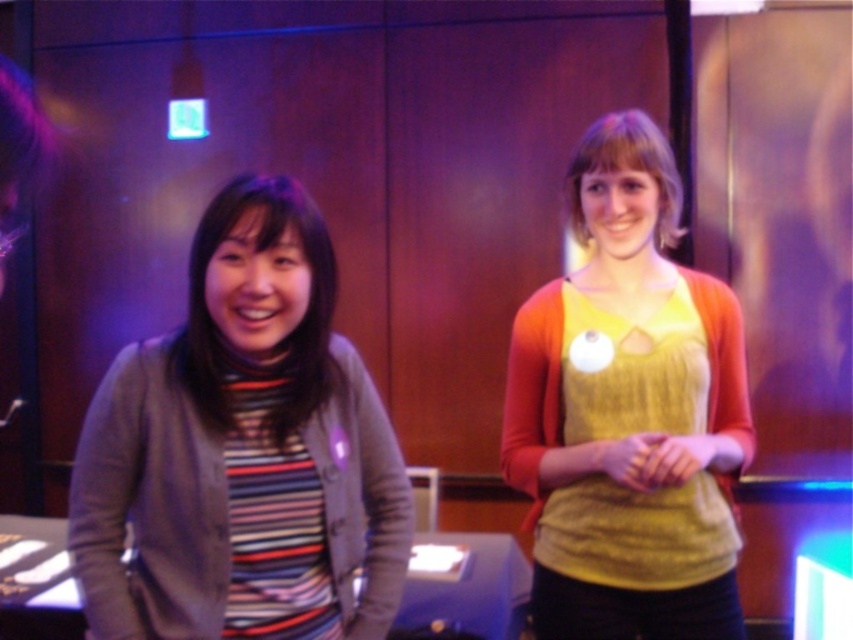
Question: Does striped knit sweater at left appear on the right side of knitted yellow sweater at center?

Choices:
 (A) yes
 (B) no

Answer: (B)

Question: Which object is farther from the camera taking this photo?

Choices:
 (A) striped knit sweater at left
 (B) knitted yellow sweater at center

Answer: (B)

Question: Does striped knit sweater at left appear under knitted yellow sweater at center?

Choices:
 (A) no
 (B) yes

Answer: (B)

Question: Observing the image, what is the correct spatial positioning of striped knit sweater at left in reference to knitted yellow sweater at center?

Choices:
 (A) left
 (B) right

Answer: (A)